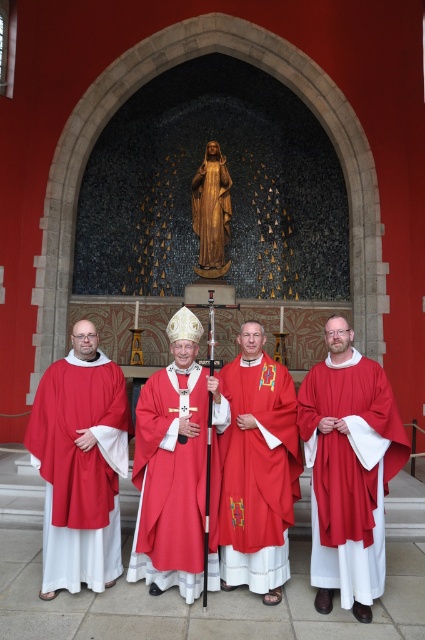
Question: Does matte red fabric at right lie in front of matte red robe at center?

Choices:
 (A) no
 (B) yes

Answer: (B)

Question: Which point is farther to the camera?

Choices:
 (A) (74, 540)
 (B) (203, 497)
 (C) (348, 380)

Answer: (C)

Question: Considering the relative positions of matte red fabric at left and wooden statue at center in the image provided, where is matte red fabric at left located with respect to wooden statue at center?

Choices:
 (A) right
 (B) left

Answer: (B)

Question: Which object is closer to the camera taking this photo?

Choices:
 (A) matte red robe at center
 (B) matte red fabric at left
 (C) matte red fabric at right
 (D) wooden statue at center

Answer: (C)

Question: Which of the following is the farthest from the observer?

Choices:
 (A) (272, 401)
 (B) (224, 216)
 (C) (119, 465)

Answer: (B)

Question: From the image, what is the correct spatial relationship of matte red fabric at right in relation to wooden statue at center?

Choices:
 (A) below
 (B) above

Answer: (A)